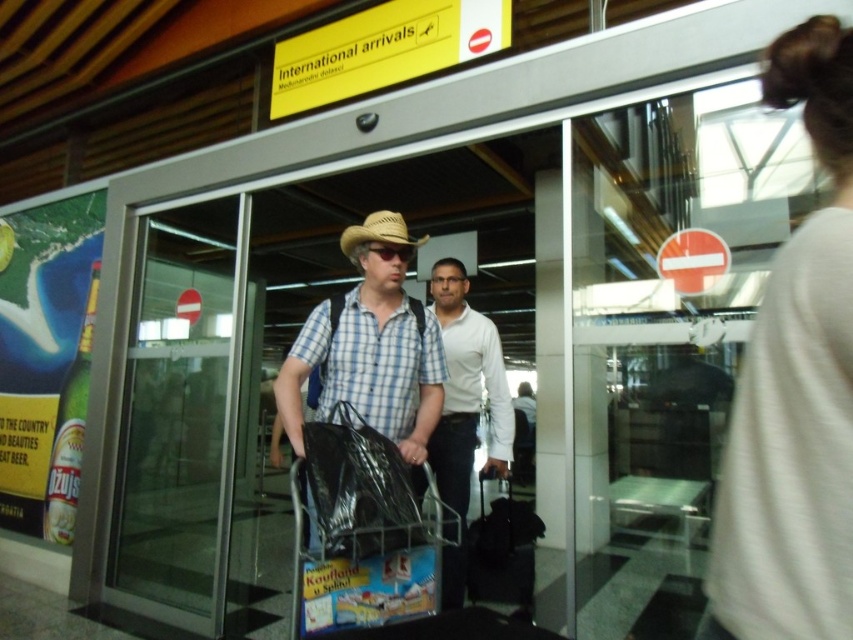
Question: Which object appears closest to the camera in this image?

Choices:
 (A) black fabric suitcase at lower right
 (B) transparent glass door at center
 (C) black plastic bag at center

Answer: (C)

Question: Which object is closer to the camera taking this photo?

Choices:
 (A) white smooth shirt at center
 (B) black plastic bag at center

Answer: (B)

Question: Where is plaid cotton shirt at center located in relation to black fabric suitcase at lower right in the image?

Choices:
 (A) above
 (B) below

Answer: (A)

Question: Is plaid cotton shirt at center to the right of black fabric suitcase at lower right from the viewer's perspective?

Choices:
 (A) no
 (B) yes

Answer: (A)

Question: Which object is farther from the camera taking this photo?

Choices:
 (A) white cotton shirt at upper right
 (B) plaid cotton shirt at center

Answer: (B)

Question: Is white cotton shirt at upper right to the right of plaid cotton shirt at center from the viewer's perspective?

Choices:
 (A) yes
 (B) no

Answer: (A)